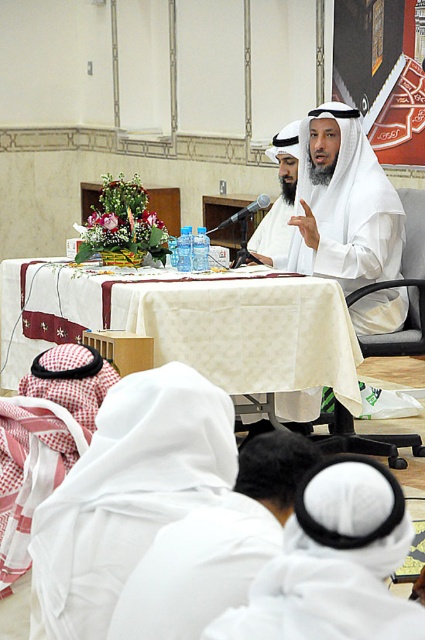
Looking at this image, who is lower down, white cloth at lower center or white cloth table at center?

white cloth at lower center is below.

Between point (214, 452) and point (346, 392), which one is positioned in front?

Point (214, 452) is more forward.

Is point (198, 464) closer to viewer compared to point (158, 346)?

That is True.

I want to click on white cloth at lower center, so click(127, 493).

Consider the image. Does white cloth at lower center appear under white matte robe at center?

Yes.

Is white cloth at lower center wider than white matte robe at center?

In fact, white cloth at lower center might be narrower than white matte robe at center.

Between point (107, 515) and point (371, 268), which one is positioned behind?

The point (371, 268) is more distant.

In order to click on white cloth at lower center in this screenshot , I will do `click(127, 493)`.

Who is more distant from viewer, (82, 305) or (331, 440)?

Positioned behind is point (331, 440).

Which is in front, point (263, 280) or point (325, 440)?

Point (263, 280) is in front.

At what (x,y) coordinates should I click in order to perform the action: click on white cloth table at center. Please return your answer as a coordinate pair (x, y). Looking at the image, I should click on (249, 332).

Find the location of a particular element. This screenshot has width=425, height=640. white cloth table at center is located at coordinates (249, 332).